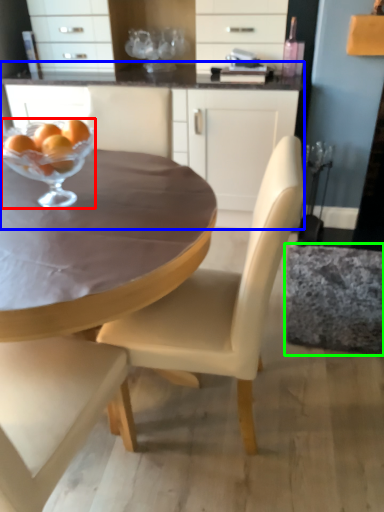
Question: Considering the real-world distances, which object is farthest from martini glass (highlighted by a red box)? cabinetry (highlighted by a blue box) or swivel chair (highlighted by a green box)?

Choices:
 (A) cabinetry
 (B) swivel chair

Answer: (B)